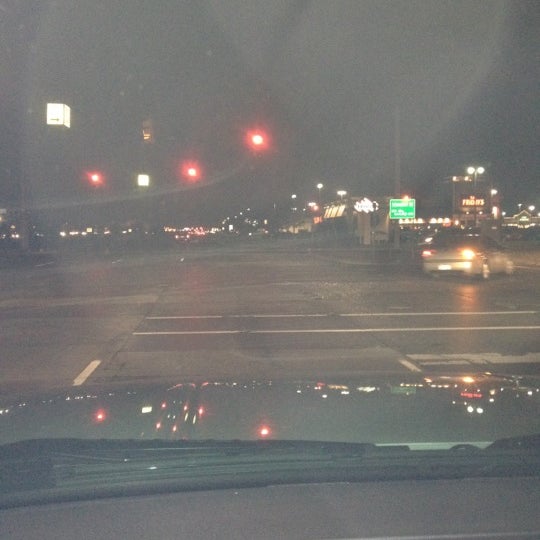
Find the location of a particular element. restaurant is located at coordinates (481, 202).